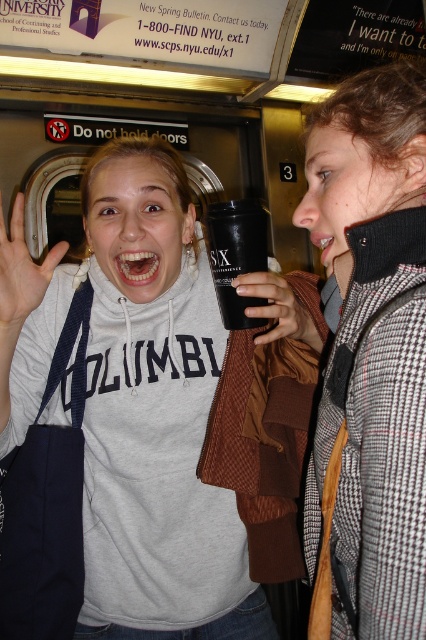
Question: Can you confirm if black matte cup at center is positioned above light skin tone hand at center?

Choices:
 (A) yes
 (B) no

Answer: (A)

Question: Among these objects, which one is farthest from the camera?

Choices:
 (A) gray sweatshirt at center
 (B) matte black cup at center
 (C) houndstooth wool coat at upper right
 (D) black matte cup at center

Answer: (D)

Question: Which object is farther from the camera taking this photo?

Choices:
 (A) gray sweatshirt at center
 (B) houndstooth wool coat at upper right

Answer: (A)

Question: Does gray sweatshirt at center have a larger size compared to light skin tone hand at center?

Choices:
 (A) no
 (B) yes

Answer: (B)

Question: Which of the following is the closest to the observer?

Choices:
 (A) (284, 292)
 (B) (311, 376)
 (C) (247, 240)

Answer: (A)

Question: Can you confirm if gray sweatshirt at center is positioned to the left of black matte cup at center?

Choices:
 (A) yes
 (B) no

Answer: (A)